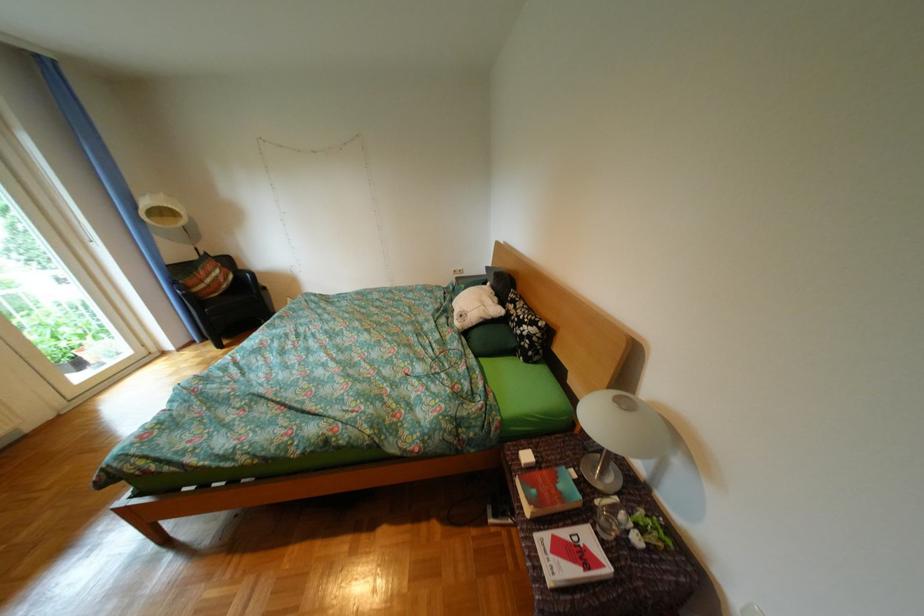
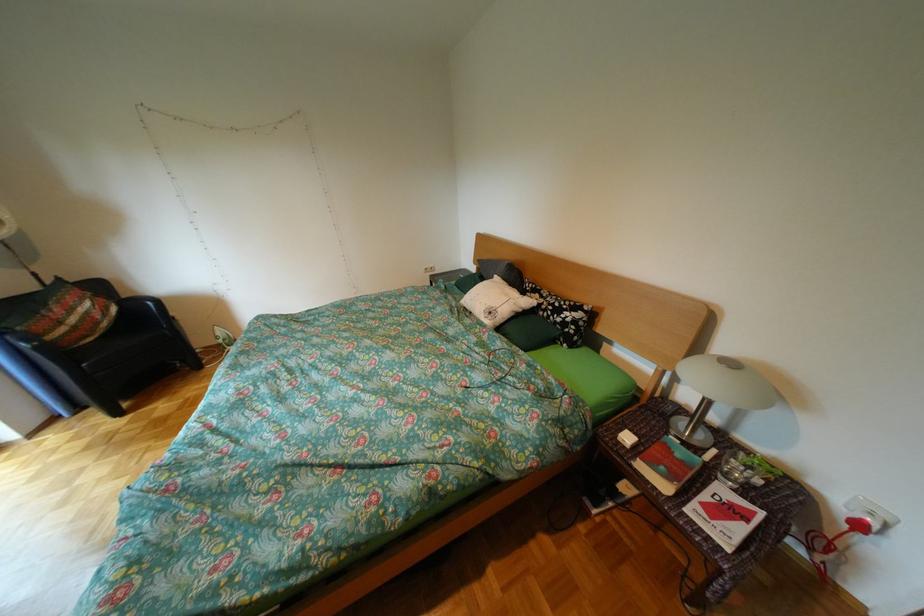
What movement of the cameraman would produce the second image?

The movement direction of the cameraman is left, forward.